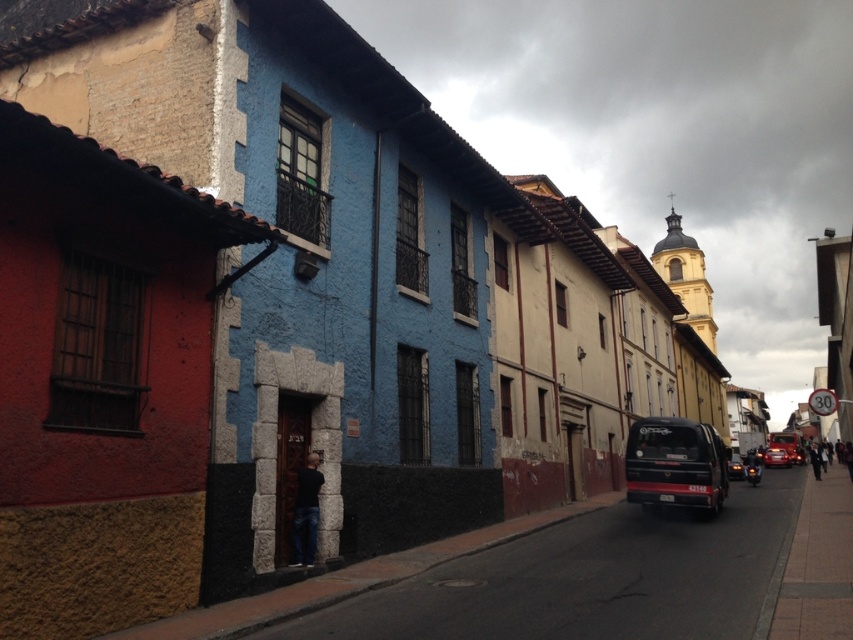
You are a delivery person who needs to park your vehicle between the black matte van at center and the shiny red car at right. Given that the parking spot is only 1.8 meters tall, can your vehicle fit vertically if you choose to park between them?

The black matte van at center is much taller than the shiny red car at right. Since the parking spot is only 1.8 meters tall, and the van is taller than the car, it is possible that the height restriction might be due to the van. However, without knowing the exact height of the van, it is uncertain if your vehicle can fit. Please check the van height first.